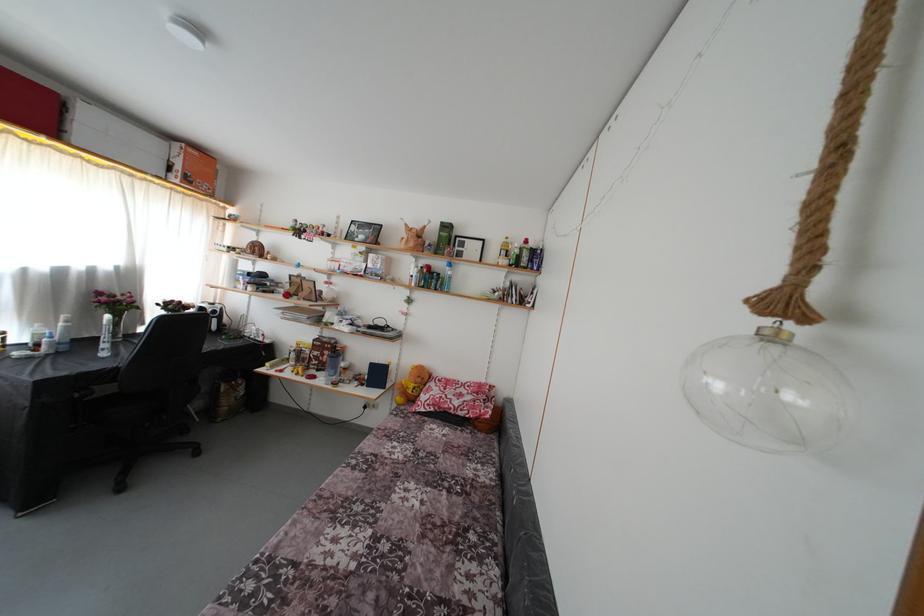
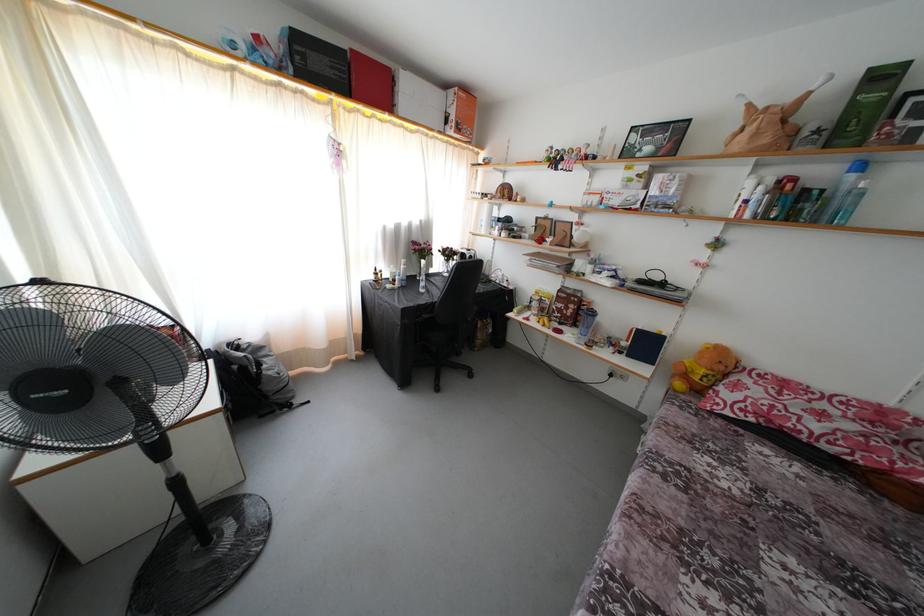
Locate, in the second image, the point that corresponds to (192,185) in the first image.

(463, 134)